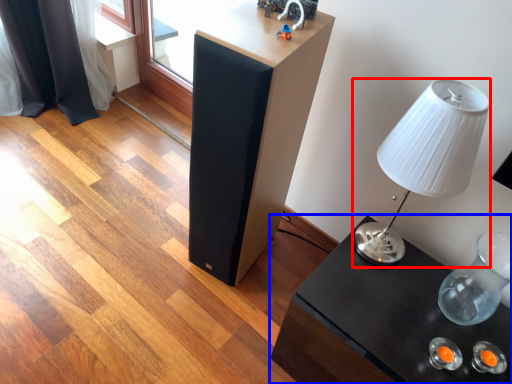
Question: Which object is closer to the camera taking this photo, lamp (highlighted by a red box) or table (highlighted by a blue box)?

Choices:
 (A) lamp
 (B) table

Answer: (A)